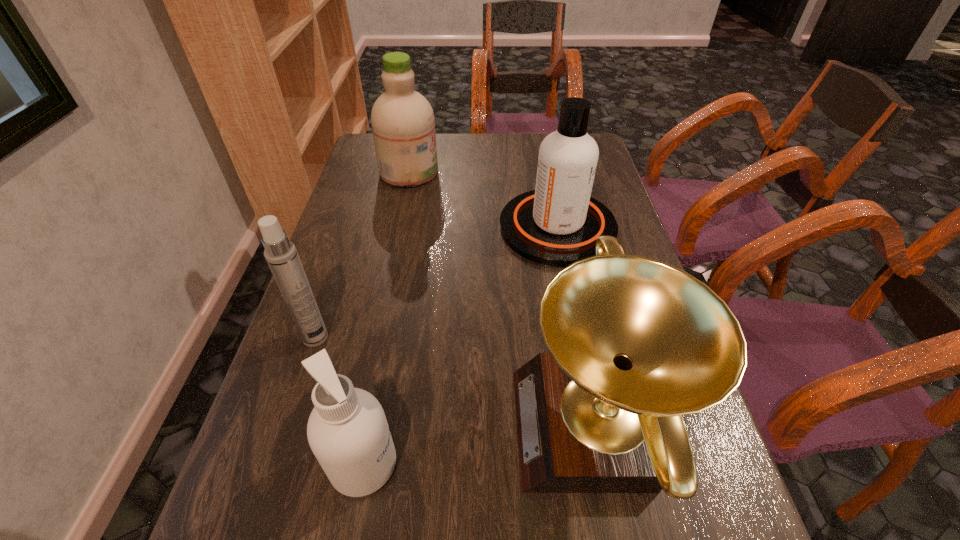
Identify the location of aerosol can that is positioned at the left edge. (280, 253).

Find the location of a particular element. The image size is (960, 540). object that is at the right edge is located at coordinates (x=558, y=223).

The width and height of the screenshot is (960, 540). What are the coordinates of `object that is positioned at the far left corner` in the screenshot? It's located at (403, 125).

Image resolution: width=960 pixels, height=540 pixels. What are the coordinates of `free point at the far edge` in the screenshot? It's located at (444, 151).

Identify the location of free space at the left edge. (342, 302).

Find the location of a particular element. Image resolution: width=960 pixels, height=540 pixels. vacant region between the aerosol can and the farthest cleansing agent is located at coordinates (362, 255).

The height and width of the screenshot is (540, 960). I want to click on unoccupied area between the farthest object and the rightmost cleansing agent, so click(x=483, y=200).

The image size is (960, 540). I want to click on vacant region between the leftmost object and the farthest object, so click(362, 255).

Identify which object is the fourth closest to the farthest cleansing agent. Please provide its 2D coordinates. Your answer should be formatted as a tuple, i.e. [(x, y)], where the tuple contains the x and y coordinates of a point satisfying the conditions above.

[(347, 430)]

I want to click on object that is the fourth closest one to the second nearest cleansing agent, so click(347, 430).